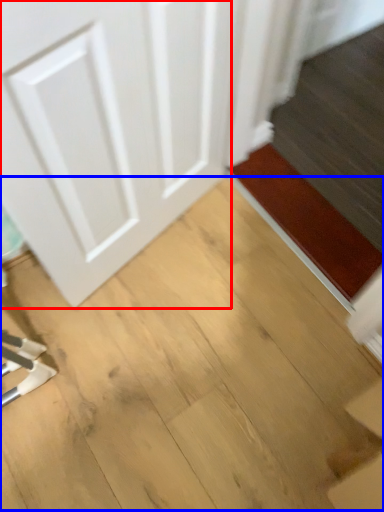
Question: Which point is closer to the camera, door (highlighted by a red box) or plywood (highlighted by a blue box)?

Choices:
 (A) door
 (B) plywood

Answer: (A)